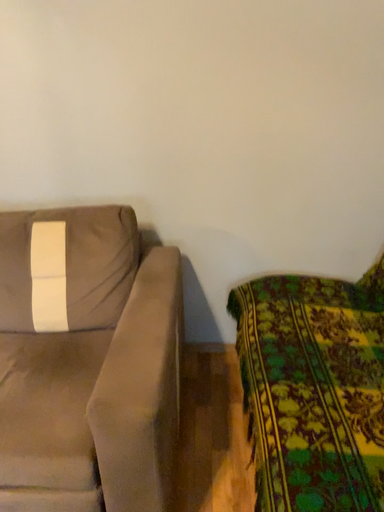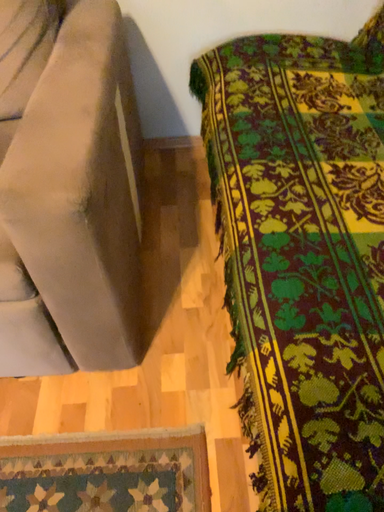
Question: Which way did the camera rotate in the video?

Choices:
 (A) rotated upward
 (B) rotated downward

Answer: (B)